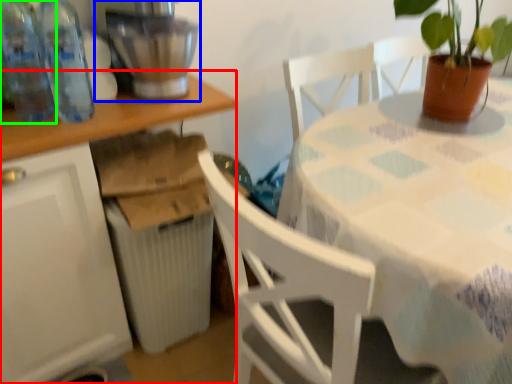
Question: Which object is the farthest from table (highlighted by a red box)? Choose among these: mixer (highlighted by a blue box) or bottle (highlighted by a green box).

Choices:
 (A) mixer
 (B) bottle

Answer: (B)